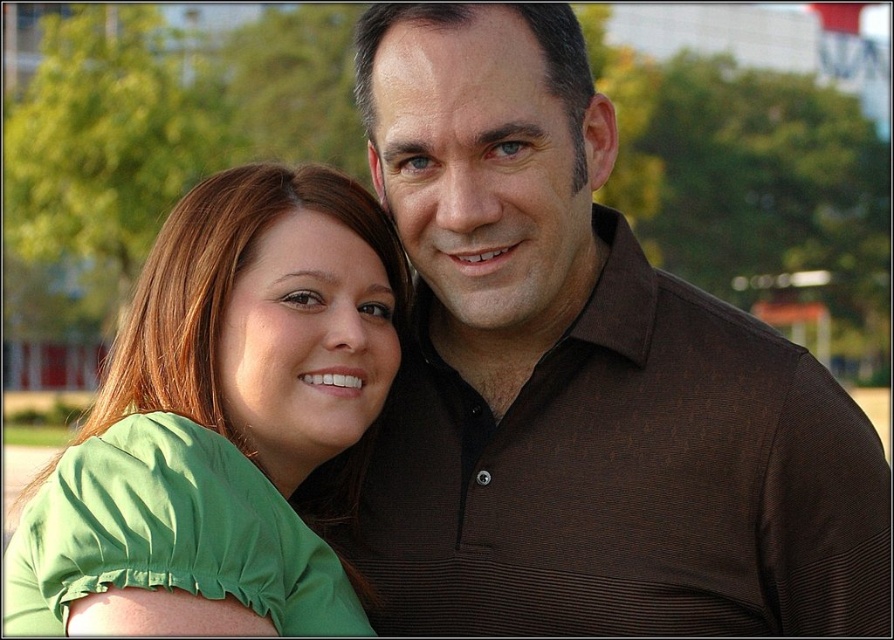
Is brown textured shirt at center bigger than green fabric shirt at left?

Incorrect, brown textured shirt at center is not larger than green fabric shirt at left.

What do you see at coordinates (580, 380) in the screenshot? The width and height of the screenshot is (894, 640). I see `brown textured shirt at center` at bounding box center [580, 380].

Locate an element on the screen. The width and height of the screenshot is (894, 640). brown textured shirt at center is located at coordinates tap(580, 380).